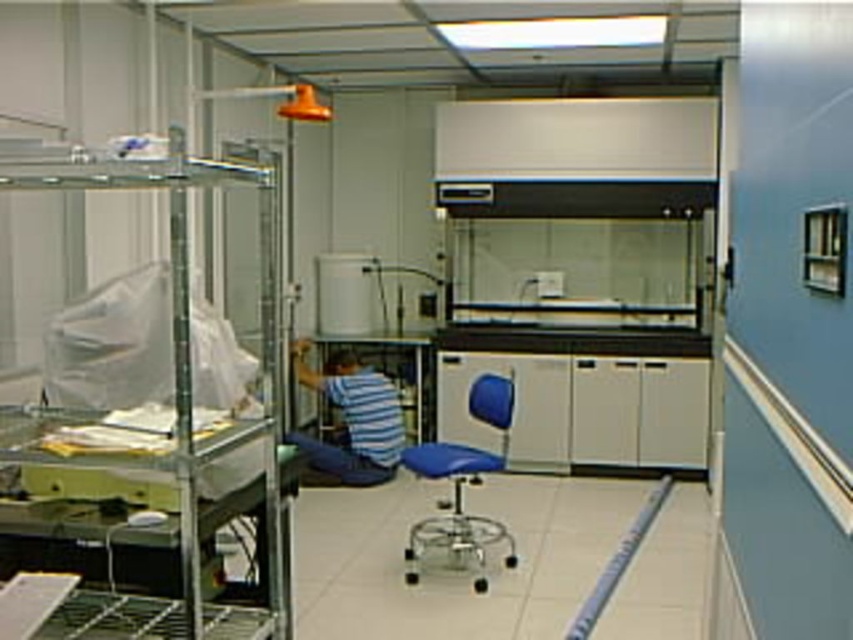
You are an inspector entering the cleanroom and need to ensure all items are within size regulations. The blue striped shirt at center and the blue fabric chair at center must not exceed 1 meter in width. Can you determine if either item violates the width requirement based on their positions?

The blue striped shirt at center might be wider than blue fabric chair at center, so there is a possibility that the blue striped shirt at center could exceed the 1 meter width limit and violate the regulations.

You are an inspector in the cleanroom and need to determine if the blue striped shirt at center can be placed on top of the blue fabric chair at center without exceeding the height limit. Can it be placed there?

The blue striped shirt at center is taller than the blue fabric chair at center, so placing it on top would exceed the height limit and is not recommended.